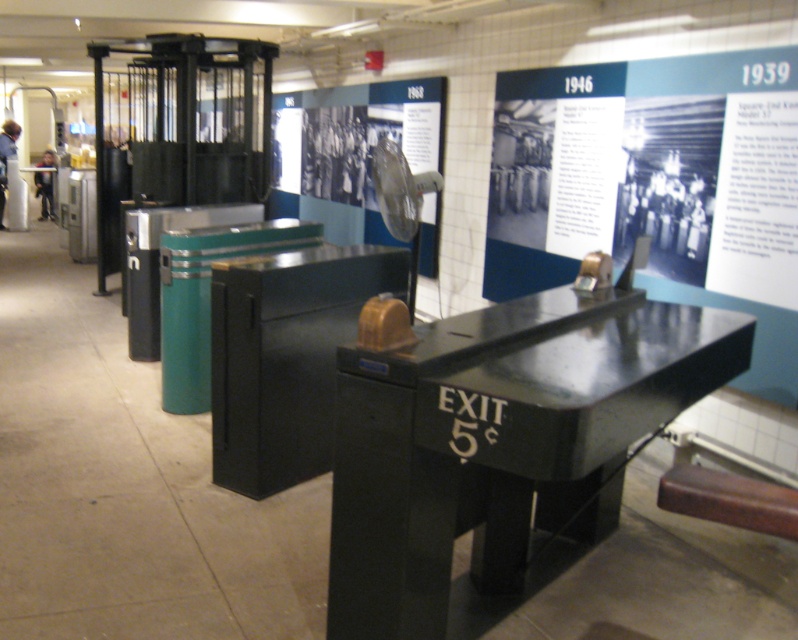
Question: Does black polished wood table at center come in front of white paper at upper center?

Choices:
 (A) yes
 (B) no

Answer: (A)

Question: Can you confirm if black polished wood table at center is bigger than white paper at upper center?

Choices:
 (A) no
 (B) yes

Answer: (A)

Question: Which of the following is the closest to the observer?

Choices:
 (A) black polished wood table at center
 (B) white paper at upper center

Answer: (A)

Question: Observing the image, what is the correct spatial positioning of black polished wood table at center in reference to white paper at upper center?

Choices:
 (A) left
 (B) right

Answer: (A)